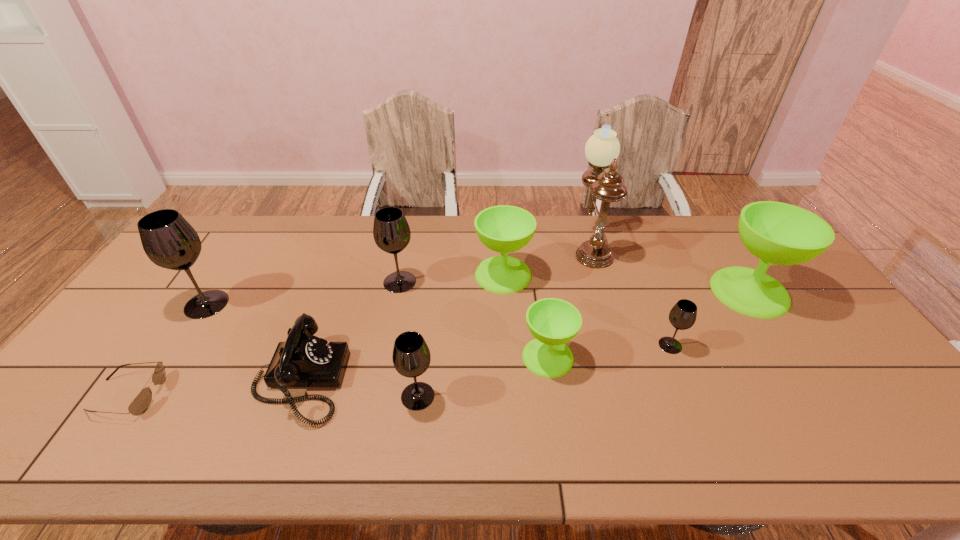
At what (x,y) coordinates should I click in order to perform the action: click on the nearest wineglass. Please return your answer as a coordinate pair (x, y). Looking at the image, I should click on (411, 357).

The height and width of the screenshot is (540, 960). I want to click on the smallest gray wineglass, so click(x=682, y=316).

Where is `the second object from right to left`? This screenshot has height=540, width=960. the second object from right to left is located at coordinates (682, 316).

I want to click on the smallest green wineglass, so click(553, 322).

At what (x,y) coordinates should I click in order to perform the action: click on the third object from left to right. Please return your answer as a coordinate pair (x, y). The width and height of the screenshot is (960, 540). Looking at the image, I should click on (303, 360).

Where is `black telephone`? The image size is (960, 540). black telephone is located at coordinates (303, 360).

At what (x,y) coordinates should I click in order to perform the action: click on the shortest object. Please return your answer as a coordinate pair (x, y). This screenshot has height=540, width=960. Looking at the image, I should click on (140, 404).

The width and height of the screenshot is (960, 540). I want to click on free location located 0.230m on the right of the third object from right to left, so click(675, 245).

What are the coordinates of `vacant space located on the right of the leftmost gray wineglass` in the screenshot? It's located at (288, 304).

The height and width of the screenshot is (540, 960). Find the location of `vacant space located 0.240m on the back of the third gray wineglass from right to left`. vacant space located 0.240m on the back of the third gray wineglass from right to left is located at coordinates (411, 227).